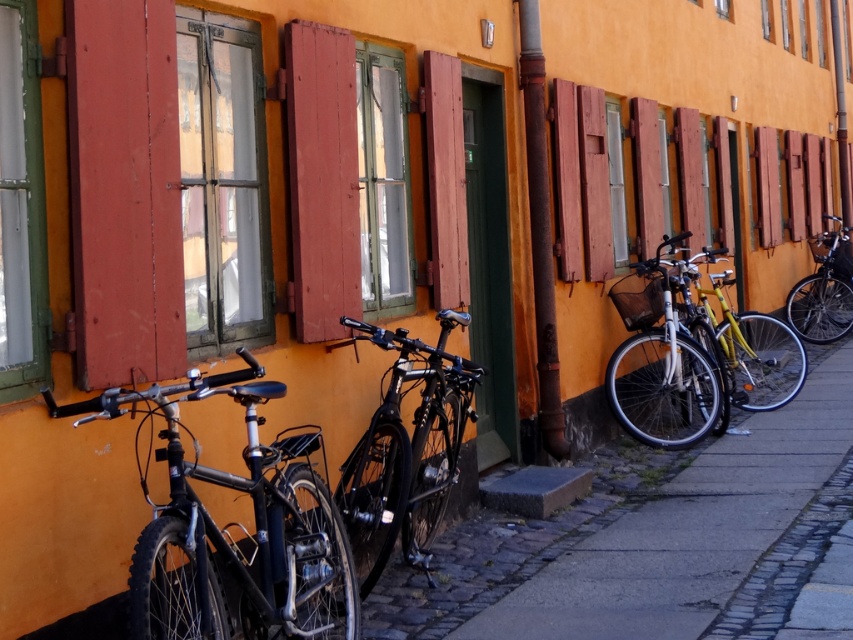
From the picture: Between shiny black bike at center and wooden shutter at center, which one has more height?

wooden shutter at center

Can you confirm if shiny black bike at center is wider than wooden shutter at center?

Yes.

Locate an element on the screen. This screenshot has width=853, height=640. shiny black bike at center is located at coordinates (233, 524).

At what (x,y) coordinates should I click in order to perform the action: click on shiny black bicycle at center. Please return your answer as a coordinate pair (x, y). Looking at the image, I should click on (405, 452).

Who is more forward, (358, 490) or (851, 280)?

Positioned in front is point (358, 490).

You are a GUI agent. You are given a task and a screenshot of the screen. Output one action in this format:
    pyautogui.click(x=<x>, y=<y>)
    Task: Click on the shiny black bicycle at center
    The width and height of the screenshot is (853, 640).
    Given the screenshot: What is the action you would take?
    pyautogui.click(x=405, y=452)

Does smooth concrete pavement at center have a greater width compared to shiny black bike at center?

Incorrect, smooth concrete pavement at center's width does not surpass shiny black bike at center's.

Based on the photo, does smooth concrete pavement at center have a lesser width compared to shiny black bike at center?

Yes.

Which is behind, point (727, 436) or point (134, 547)?

Positioned behind is point (727, 436).

Where is `smooth concrete pavement at center`? This screenshot has width=853, height=640. smooth concrete pavement at center is located at coordinates (712, 540).